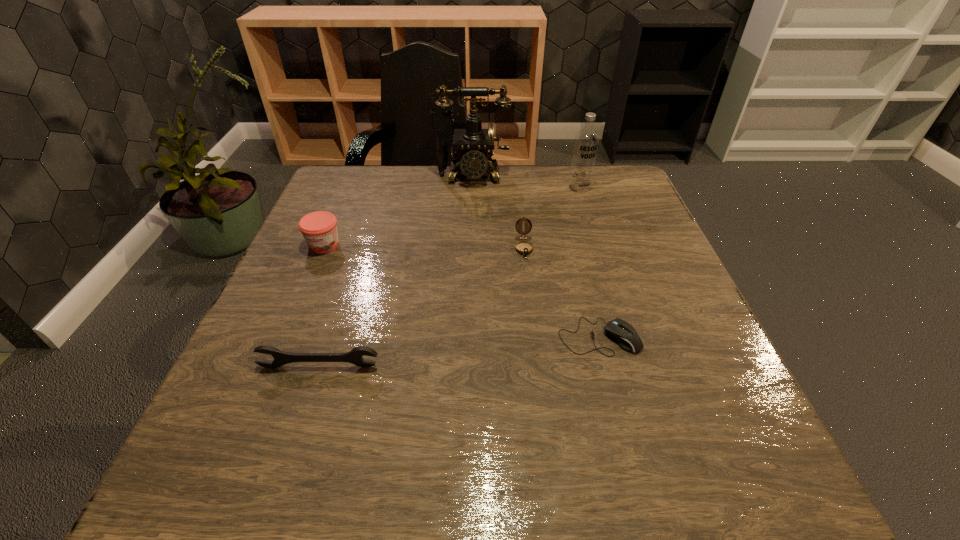
The height and width of the screenshot is (540, 960). What are the coordinates of `free space between the tallest object and the compass` in the screenshot? It's located at (497, 212).

You are a GUI agent. You are given a task and a screenshot of the screen. Output one action in this format:
    pyautogui.click(x=<x>, y=<y>)
    Task: Click on the free space that is in between the compass and the third tallest object
    
    Given the screenshot: What is the action you would take?
    pyautogui.click(x=424, y=246)

Where is `unoccupied position between the shortest object and the tallest object`? unoccupied position between the shortest object and the tallest object is located at coordinates (536, 256).

Where is `free space between the nearest object and the computer mouse`? This screenshot has height=540, width=960. free space between the nearest object and the computer mouse is located at coordinates (459, 352).

The width and height of the screenshot is (960, 540). Find the location of `vacant area that lies between the fifth shortest object and the nearest object`. vacant area that lies between the fifth shortest object and the nearest object is located at coordinates tap(449, 277).

You are a GUI agent. You are given a task and a screenshot of the screen. Output one action in this format:
    pyautogui.click(x=<x>, y=<y>)
    Task: Click on the free space that is in between the vodka and the nearest object
    This screenshot has width=960, height=540.
    Given the screenshot: What is the action you would take?
    pyautogui.click(x=449, y=277)

Identify which object is the second nearest to the second nearest object. Please provide its 2D coordinates. Your answer should be formatted as a tuple, i.e. [(x, y)], where the tuple contains the x and y coordinates of a point satisfying the conditions above.

[(354, 356)]

Where is `object that ranks as the third closest to the wrench`? This screenshot has height=540, width=960. object that ranks as the third closest to the wrench is located at coordinates click(x=524, y=248).

The image size is (960, 540). I want to click on free space that satisfies the following two spatial constraints: 1. on the front label of the shortest object; 2. on the left side of the third tallest object, so click(285, 336).